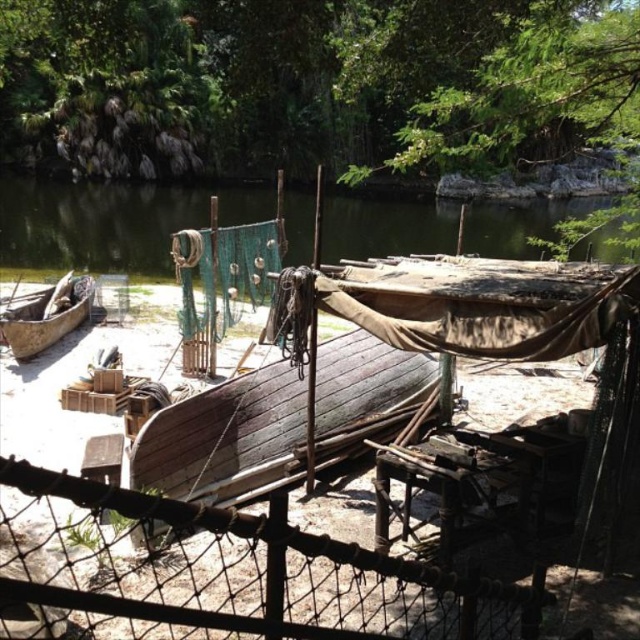
Looking at this image, you are a painter standing at the edge of the dock. You need to paint the wire mesh fence at center and the dark brown wooden boat at center. Which object should you paint first if you want to start with the taller one?

The dark brown wooden boat at center is taller than the wire mesh fence at center, so you should paint the dark brown wooden boat at center first.

You are a maintenance worker needing to inspect both the wire mesh fence at center and the rusty wire mesh at center. Given that your tool kit is 1.5 meters wide, can you carry it horizontally between them without tilting it?

The distance between the wire mesh fence at center and the rusty wire mesh at center is 4.75 meters. Since the tool kit is only 1.5 meters wide, there is ample space to carry it horizontally between them without tilting.

You are planning to secure a small animal that is 1 meter tall in the area near the wire mesh fence at center and the brown wooden canoe at left. Based on their heights, which object would be more suitable to use as a barrier to prevent the animal from escaping?

The brown wooden canoe at left is taller than the wire mesh fence at center, so it would be more suitable as a barrier to prevent the animal from escaping since it is taller than the 1 meter tall animal.